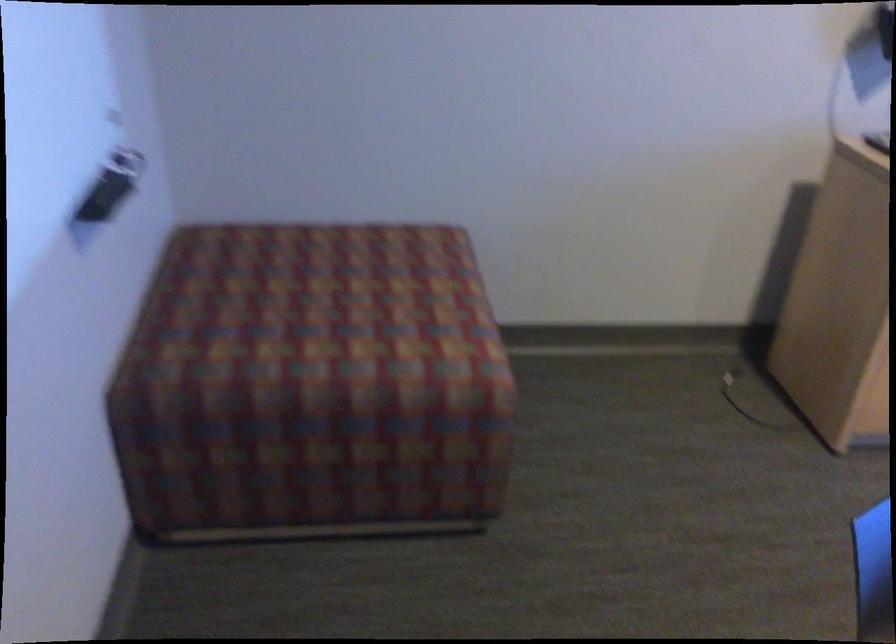
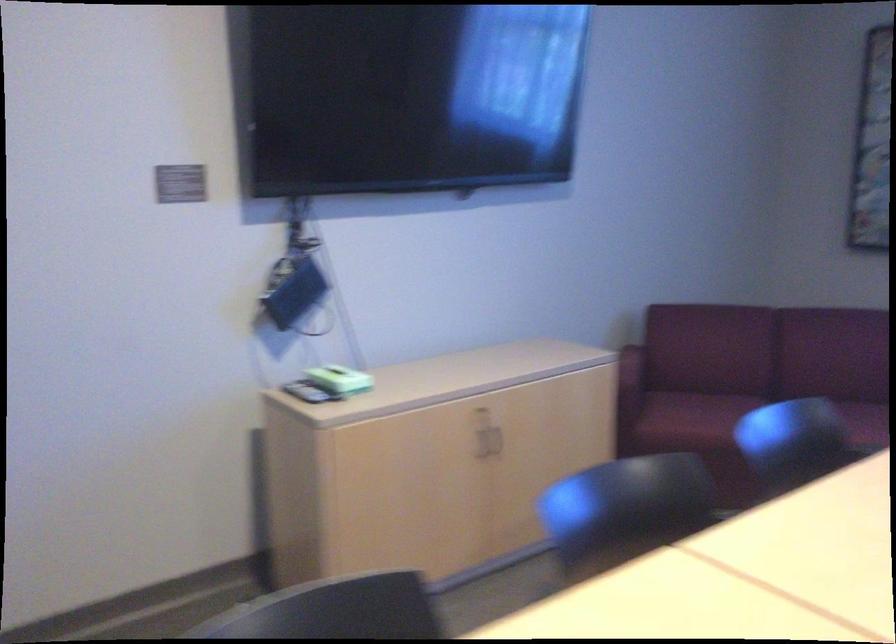
Question: The camera is either moving clockwise (left) or counter-clockwise (right) around the object. The first image is from the beginning of the video and the second image is from the end. Is the camera moving left or right when shooting the video?

Choices:
 (A) Left
 (B) Right

Answer: (A)